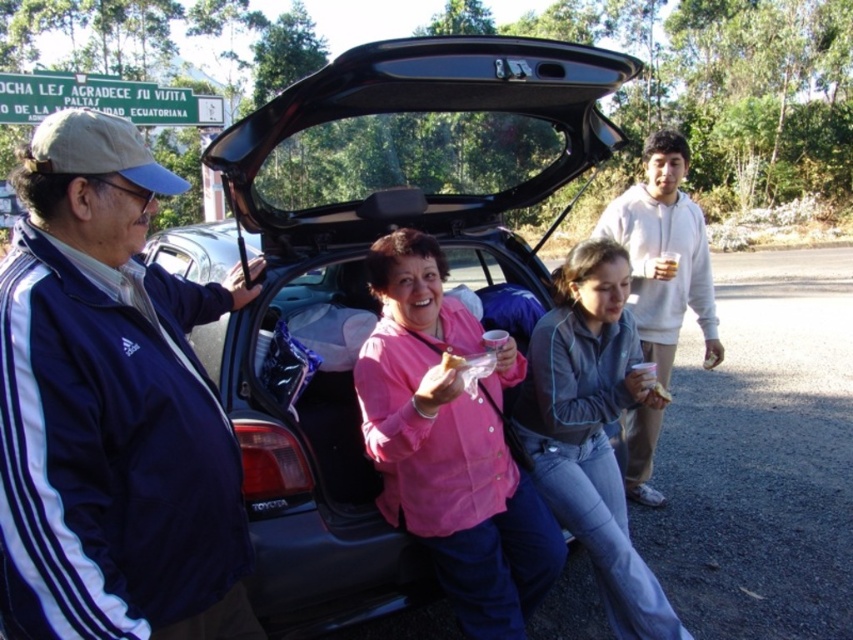
Who is shorter, black matte car trunk at center or golden crispy pastry at lower center?

With less height is golden crispy pastry at lower center.

What do you see at coordinates (363, 275) in the screenshot? I see `black matte car trunk at center` at bounding box center [363, 275].

The image size is (853, 640). I want to click on black matte car trunk at center, so click(x=363, y=275).

Which is below, pink fabric at center or golden crispy pastry at lower center?

Positioned lower is pink fabric at center.

The height and width of the screenshot is (640, 853). What are the coordinates of `pink fabric at center` in the screenshot? It's located at (450, 444).

Who is higher up, black matte car trunk at center or translucent plastic cup at center?

Positioned higher is black matte car trunk at center.

Between point (283, 291) and point (447, 358), which one is positioned behind?

The point (283, 291) is behind.

Describe the element at coordinates (363, 275) in the screenshot. I see `black matte car trunk at center` at that location.

Find the location of a particular element. This screenshot has width=853, height=640. black matte car trunk at center is located at coordinates (363, 275).